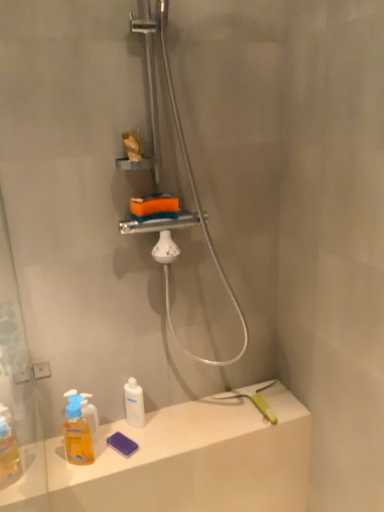
Locate an element on the screen. The height and width of the screenshot is (512, 384). free point in front of white glossy bottle at lower center, the first mouthwash from the right is located at coordinates (125, 453).